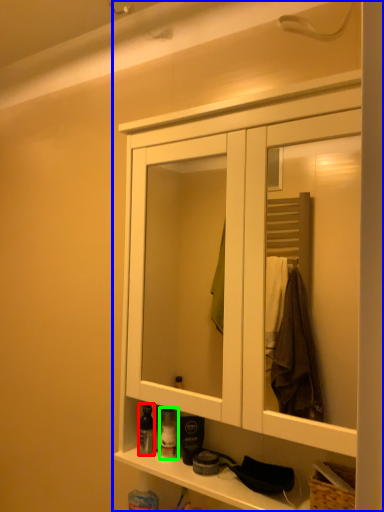
Question: Considering the real-world distances, which object is farthest from toiletry (highlighted by a red box)? cabinetry (highlighted by a blue box) or toiletry (highlighted by a green box)?

Choices:
 (A) cabinetry
 (B) toiletry

Answer: (A)